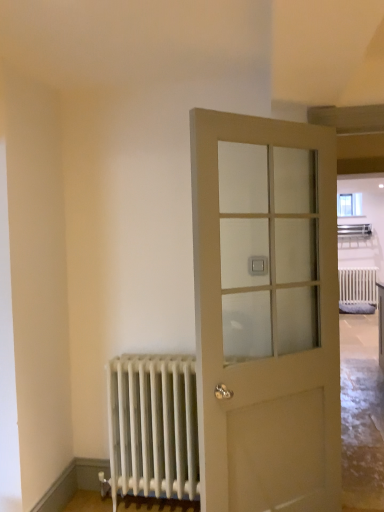
Question: From their relative heights in the image, would you say white metallic radiator at lower left is taller or shorter than matte glass door at center?

Choices:
 (A) tall
 (B) short

Answer: (B)

Question: Considering the relative positions of white metallic radiator at lower left and matte glass door at center in the image provided, is white metallic radiator at lower left to the left or to the right of matte glass door at center?

Choices:
 (A) left
 (B) right

Answer: (A)

Question: Considering their positions, is white metallic radiator at lower left located in front of or behind matte glass door at center?

Choices:
 (A) behind
 (B) front

Answer: (A)

Question: Based on their sizes in the image, would you say matte glass door at center is bigger or smaller than white metallic radiator at lower left?

Choices:
 (A) small
 (B) big

Answer: (B)

Question: Would you say matte glass door at center is to the left or to the right of white metallic radiator at lower left in the picture?

Choices:
 (A) left
 (B) right

Answer: (B)

Question: Is point (339, 412) positioned closer to the camera than point (140, 381)?

Choices:
 (A) closer
 (B) farther

Answer: (A)

Question: From the image's perspective, is matte glass door at center located above or below white metallic radiator at lower left?

Choices:
 (A) above
 (B) below

Answer: (A)